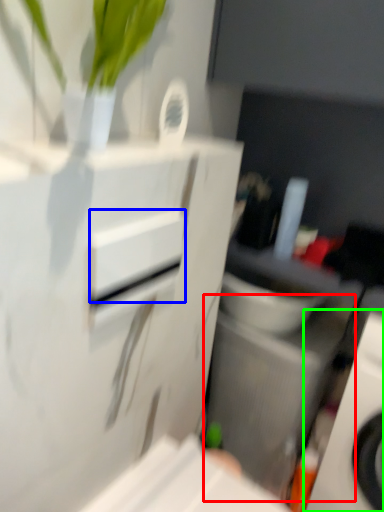
Question: Which is farther away from appliance (highlighted by a red box)? drawer (highlighted by a blue box) or home appliance (highlighted by a green box)?

Choices:
 (A) drawer
 (B) home appliance

Answer: (A)